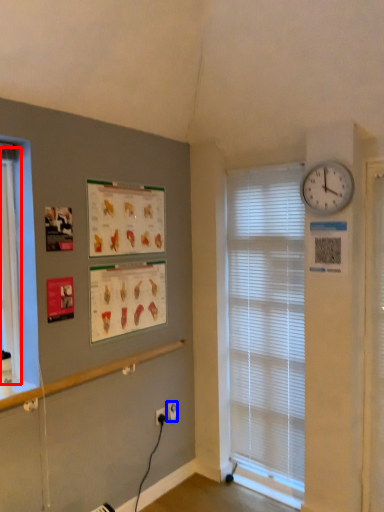
Question: Which of the following is the closest to the observer, bay window (highlighted by a red box) or electric outlet (highlighted by a blue box)?

Choices:
 (A) bay window
 (B) electric outlet

Answer: (A)